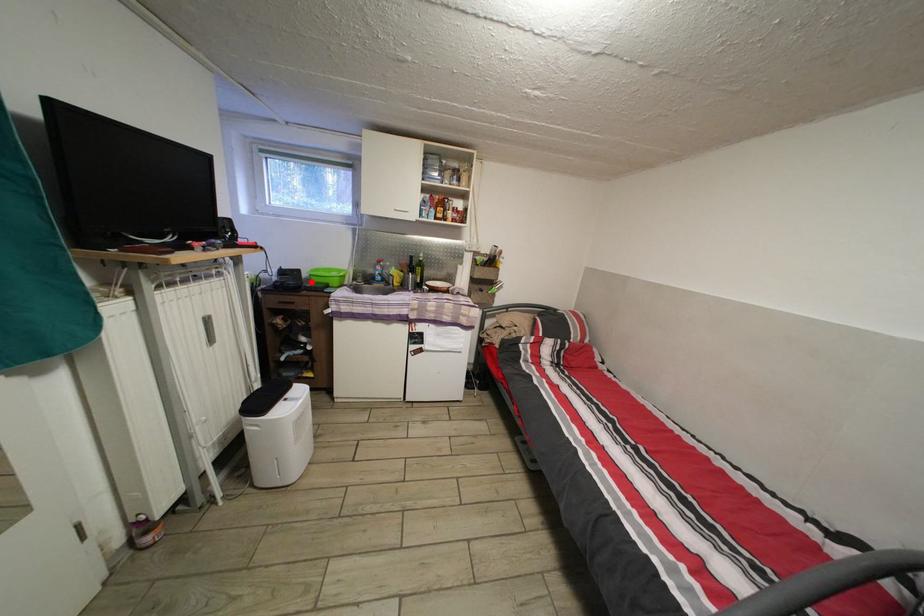
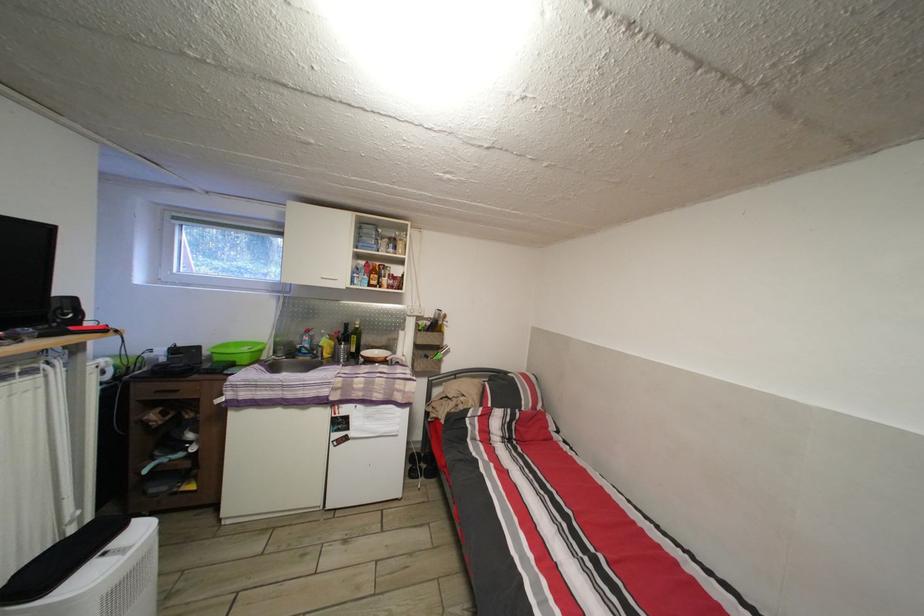
Question: I am providing you with two images of the same scene from different viewpoints. A red point is marked on the first image. Is the red point's position out of view in image 2?

Choices:
 (A) Yes
 (B) No

Answer: (B)